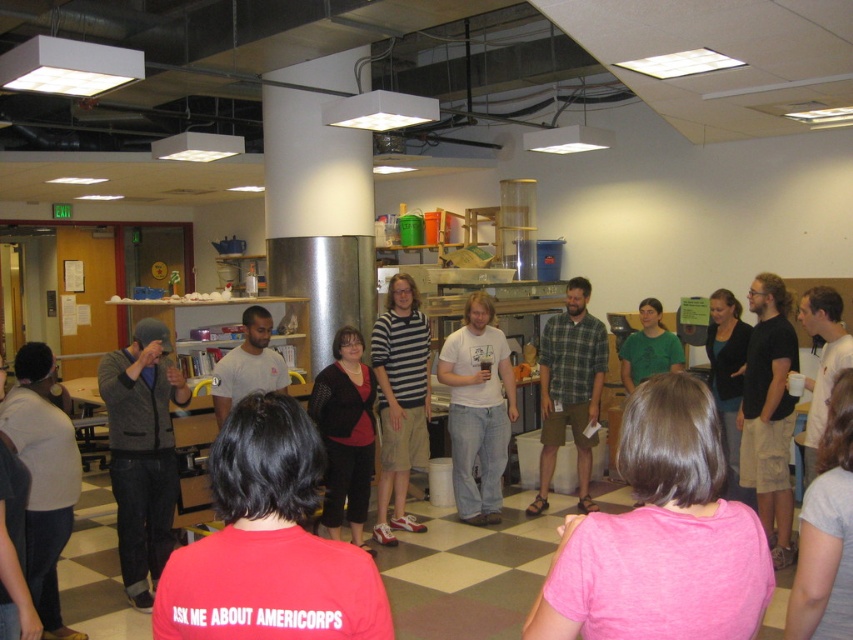
Question: Which of the following is the closest to the observer?

Choices:
 (A) pink cotton shirt at center
 (B) red matte shirt at center
 (C) dark gray knit hat at left

Answer: (B)

Question: Is red matte shirt at center to the left of green plaid shirt at center from the viewer's perspective?

Choices:
 (A) yes
 (B) no

Answer: (A)

Question: Does red matte shirt at center lie in front of light brown cotton shirt at center?

Choices:
 (A) yes
 (B) no

Answer: (A)

Question: From the image, what is the correct spatial relationship of light brown cotton shirt at center in relation to green plaid shirt at center?

Choices:
 (A) right
 (B) left

Answer: (A)

Question: Which of the following is the closest to the observer?

Choices:
 (A) (577, 384)
 (B) (648, 401)
 (C) (128, 465)

Answer: (B)

Question: Estimate the real-world distances between objects in this image. Which object is farther from the light brown cotton shirt at center?

Choices:
 (A) red matte shirt at center
 (B) dark gray knit hat at left
 (C) pink cotton shirt at center

Answer: (A)